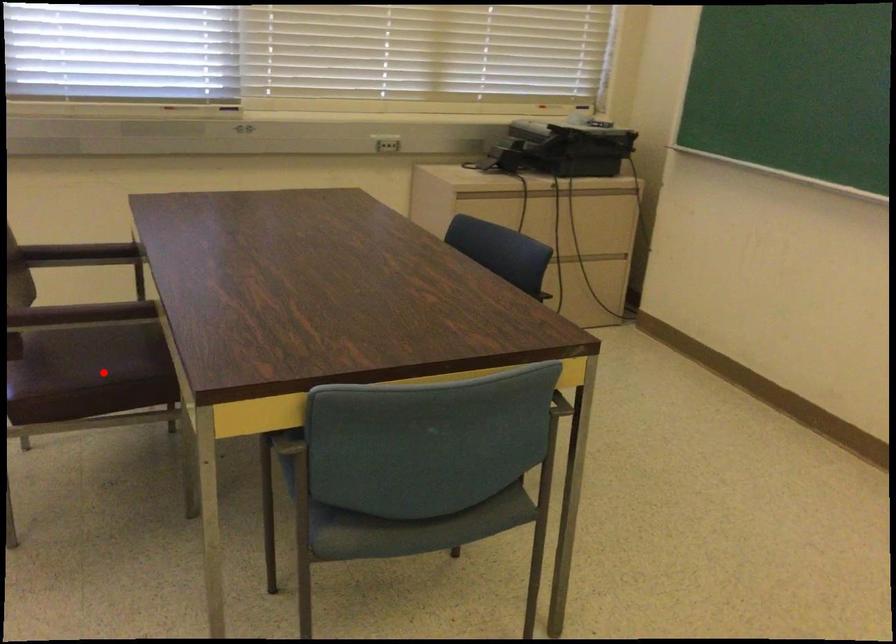
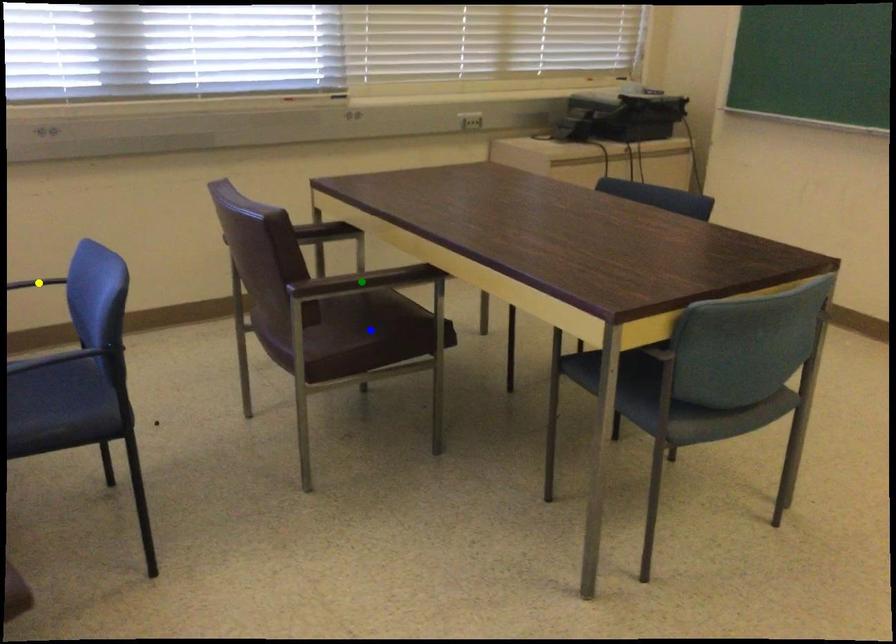
Question: I am providing you with two images of the same scene from different viewpoints. A red point is marked on the first image. You are given multiple points on the second image. In image 2, which mark is for the same physical point as the one in image 1?

Choices:
 (A) yellow point
 (B) green point
 (C) blue point

Answer: (C)